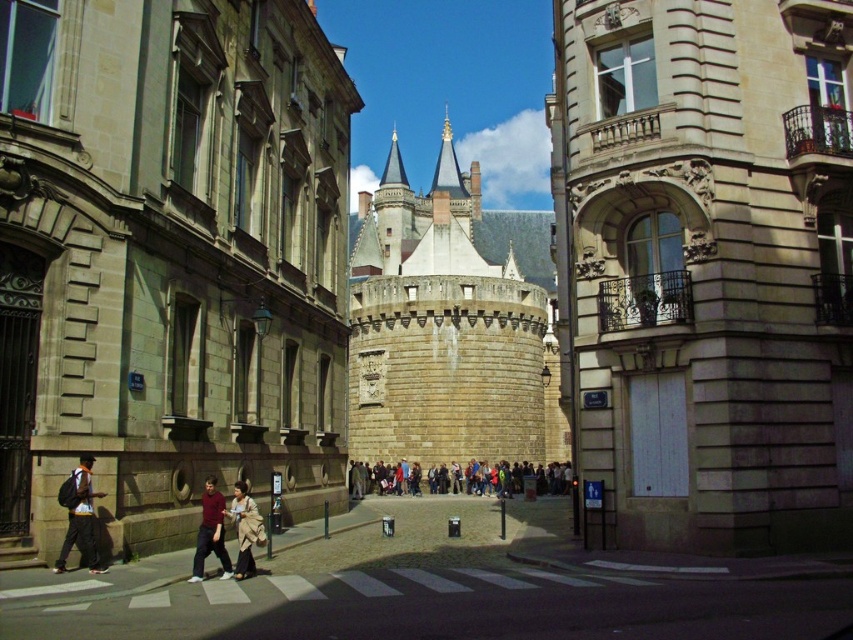
You are a tourist standing in the middle of the street looking at the stone castle at center and the dark red fabric pants at lower center. Which object is larger in size?

The stone castle at center is bigger than the dark red fabric pants at lower center according to the description.

You are standing on the street in front of the stone tower at center. If you walk straight ahead, will you move away from or towards the tower?

Since you are standing in front of the stone tower at center, walking straight ahead would take you away from the tower.